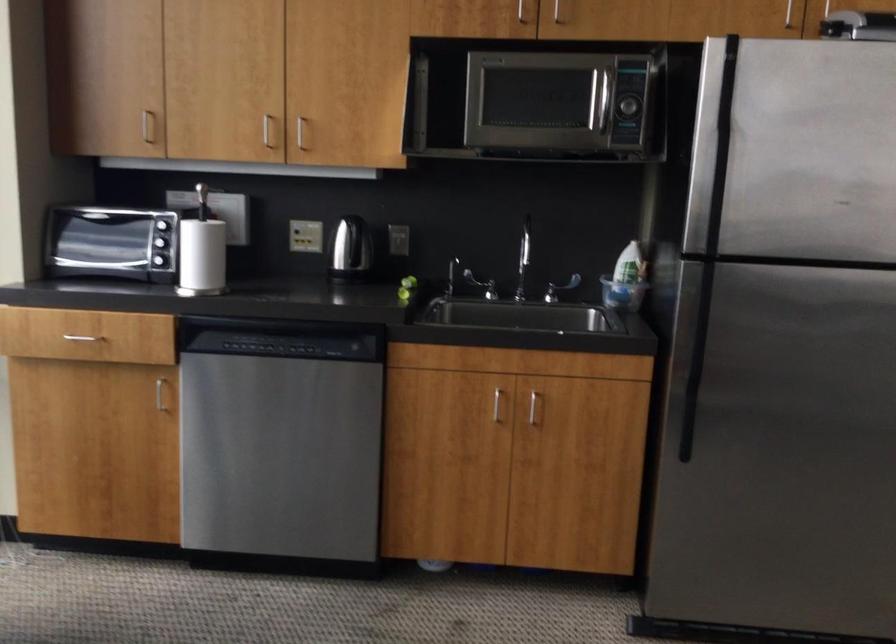
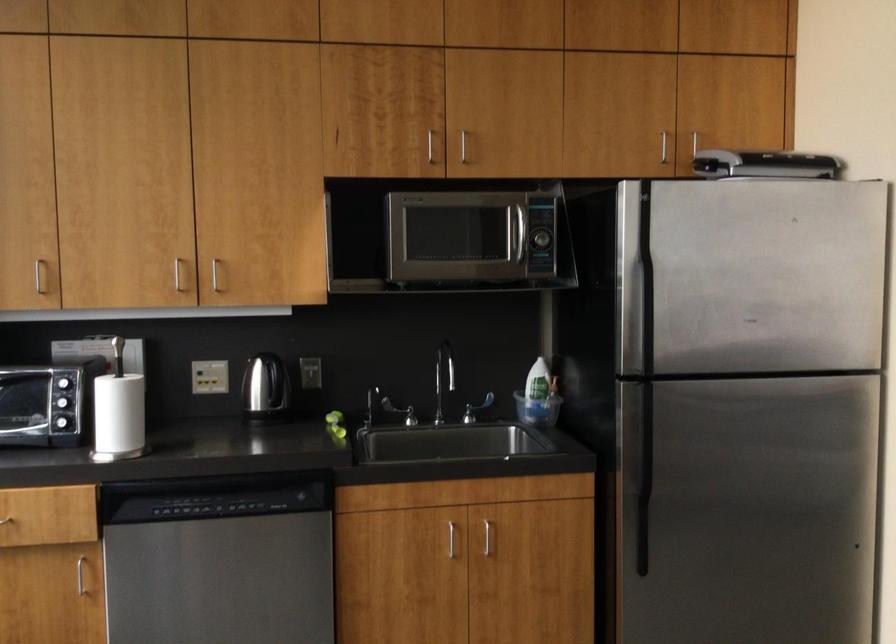
The point at (271, 313) is marked in the first image. Where is the corresponding point in the second image?

(208, 471)